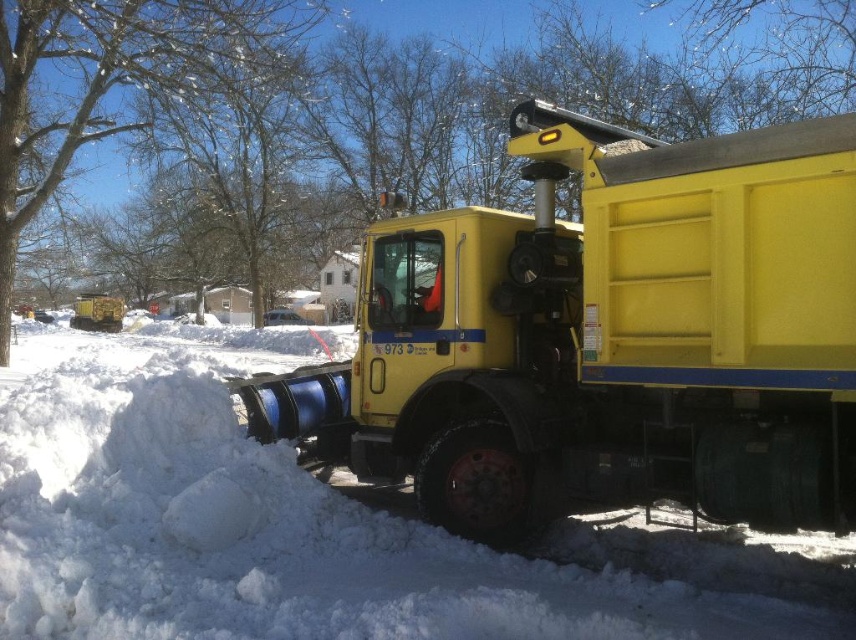
You are a delivery driver who needs to park your truck next to the yellow matte truck at center. There is a white fluffy snow at lower left nearby. Based on their sizes, can you estimate if there is enough space between them to fit your truck?

The yellow matte truck at center is narrower than the white fluffy snow at lower left. However, since the white fluffy snow at lower left is likely a pile of snow, its width might not be a reliable measure for parking space. You should check the actual available space between the two objects before deciding to park.

You are standing on the sidewalk and want to cross the street to reach the yellow matte truck at center. The road is 5 meters wide. Can you safely cross the road without getting too close to the truck?

The yellow matte truck at center is 4.34 meters away from you. Since the road is 5 meters wide and the truck is only 4.34 meters away, you can safely cross the road without getting too close to the truck.

You are driving a delivery van and need to turn left onto the street where the yellow matte truck at center is parked. There is white fluffy snow at lower left blocking your path. Can you safely make the turn without hitting the snow?

The white fluffy snow at lower left is behind the yellow matte truck at center, so it is not blocking your path. You can safely make the turn without hitting the snow.